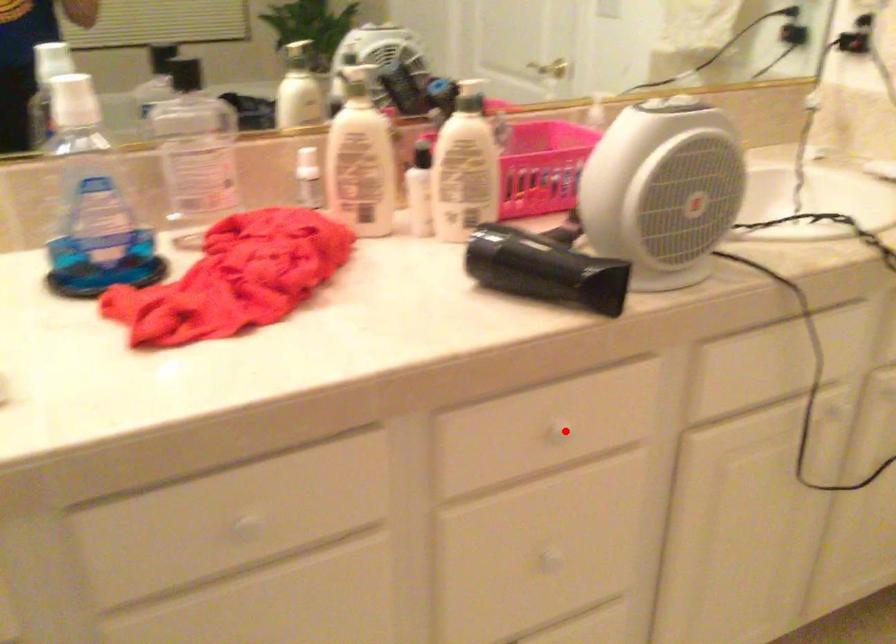
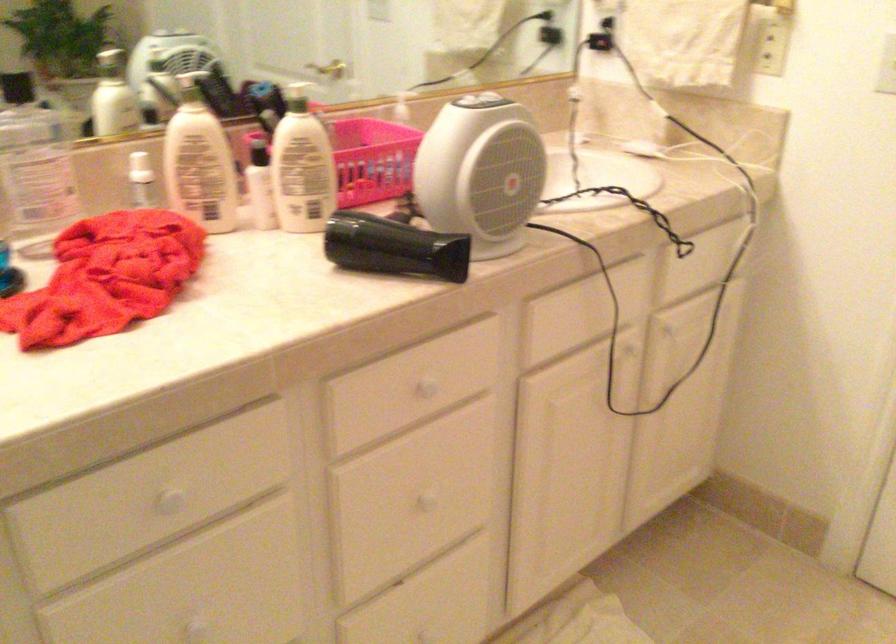
Question: A red point is marked in image1. In image2, is the corresponding 3D point closer to the camera or farther? Reply with the corresponding letter.

Choices:
 (A) The corresponding 3D point is closer.
 (B) The corresponding 3D point is farther.

Answer: (B)